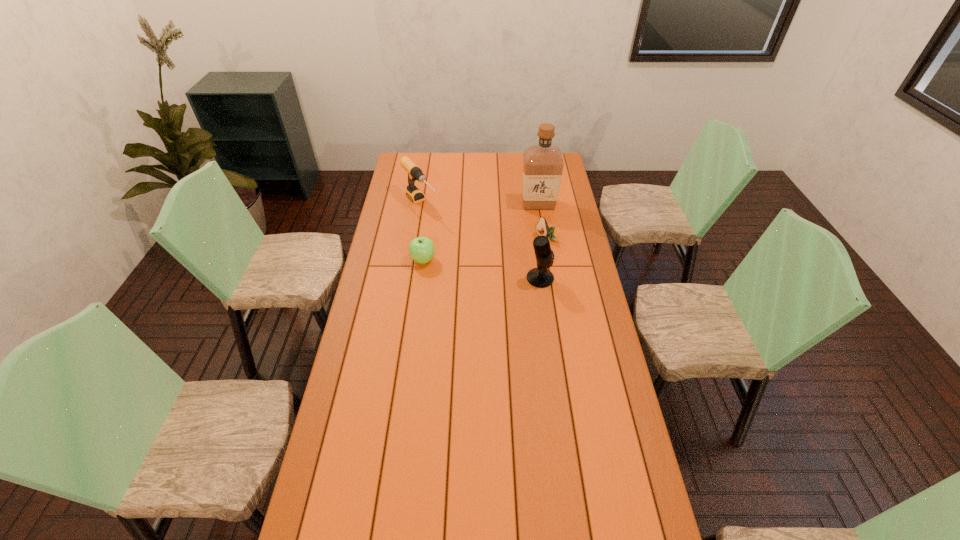
At what (x,y) coordinates should I click in order to perform the action: click on free space on the desktop that is between the apple and the microphone and is positioned on the front-facing side of the liquor. Please return your answer as a coordinate pair (x, y). The image size is (960, 540). Looking at the image, I should click on (480, 269).

Locate an element on the screen. vacant space on the desktop that is between the apple and the microphone and is positioned on the handle side of the drill is located at coordinates click(482, 269).

The height and width of the screenshot is (540, 960). I want to click on free space on the desktop that is between the apple and the microphone and is positioned on the seed side of the avocado, so click(495, 271).